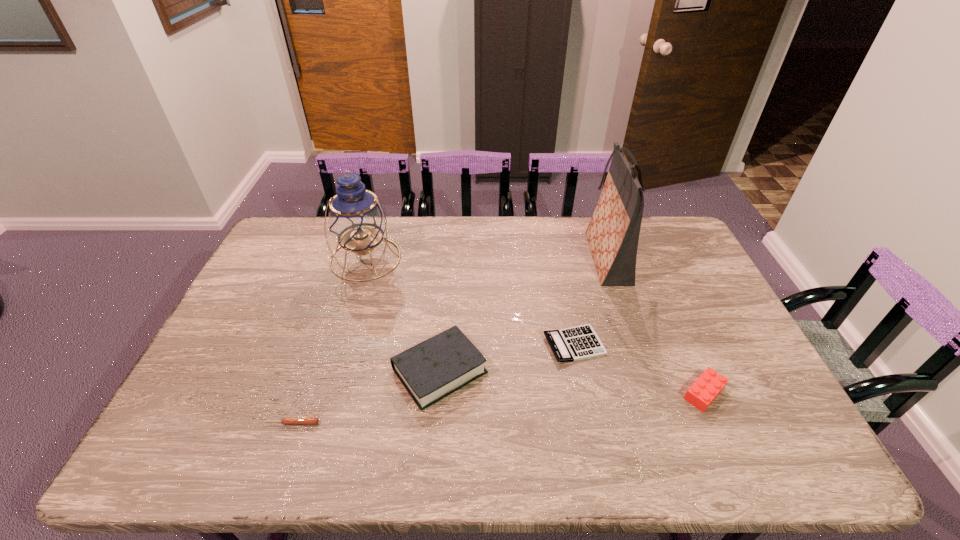
Find the location of a particular element. Image resolution: width=960 pixels, height=540 pixels. vacant space that satisfies the following two spatial constraints: 1. on the front-facing side of the calculator; 2. on the left side of the lantern is located at coordinates (340, 345).

The image size is (960, 540). Find the location of `free space that satisfies the following two spatial constraints: 1. on the back side of the Lego; 2. on the front-facing side of the shopping bag`. free space that satisfies the following two spatial constraints: 1. on the back side of the Lego; 2. on the front-facing side of the shopping bag is located at coordinates (645, 258).